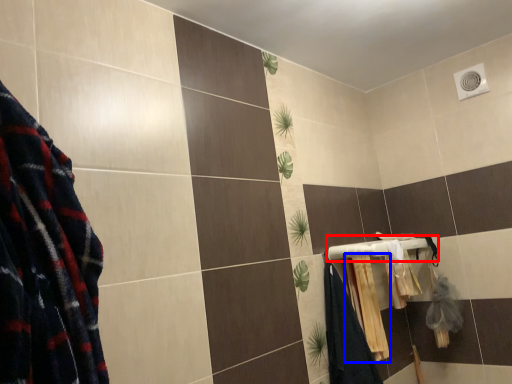
Question: Which point is closer to the camera, towel bar (highlighted by a red box) or bath towel (highlighted by a blue box)?

Choices:
 (A) towel bar
 (B) bath towel

Answer: (A)